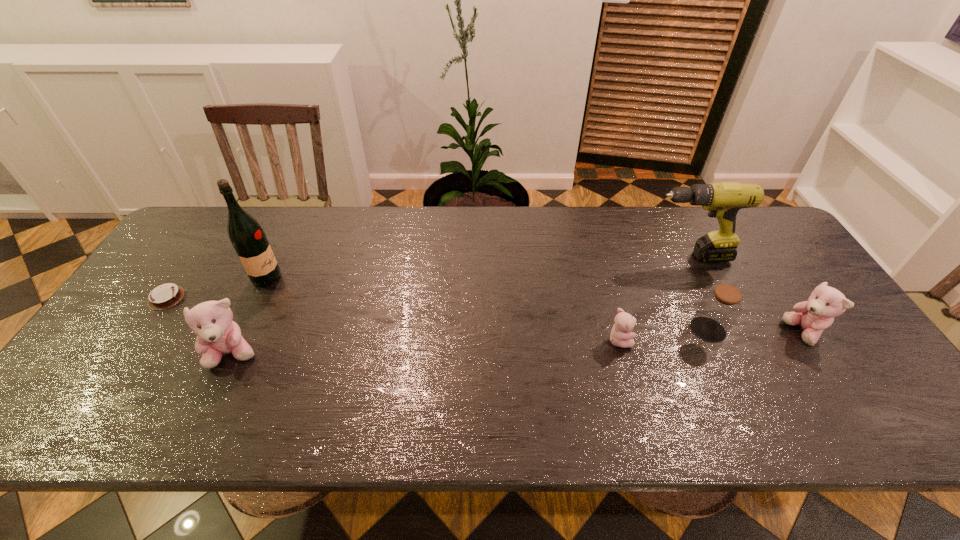
Where is `free space at the near right corner of the desktop`? free space at the near right corner of the desktop is located at coordinates (839, 371).

Find the location of a particular element. This screenshot has height=540, width=960. vacant space that is in between the second tallest object and the second tallest teddy bear is located at coordinates (746, 294).

Find the location of a particular element. The image size is (960, 540). free space that is in between the jar and the second shortest object is located at coordinates (663, 335).

Identify the location of empty space that is in between the drill and the second shortest teddy bear. (746, 294).

I want to click on empty space between the drill and the leftmost teddy bear, so tap(461, 306).

Image resolution: width=960 pixels, height=540 pixels. Identify the location of vacant point located between the leftmost object and the rightmost object. point(485,315).

Locate an element on the screen. vacant point located between the leftmost teddy bear and the fourth object from left to right is located at coordinates click(x=426, y=347).

The image size is (960, 540). Find the location of `vacant space in between the liquor and the second teddy bear from right to left`. vacant space in between the liquor and the second teddy bear from right to left is located at coordinates [443, 308].

Locate an element on the screen. This screenshot has width=960, height=540. free space between the leftmost teddy bear and the tallest object is located at coordinates (251, 316).

This screenshot has width=960, height=540. What are the coordinates of `free space between the farthest object and the jar` in the screenshot? It's located at (698, 293).